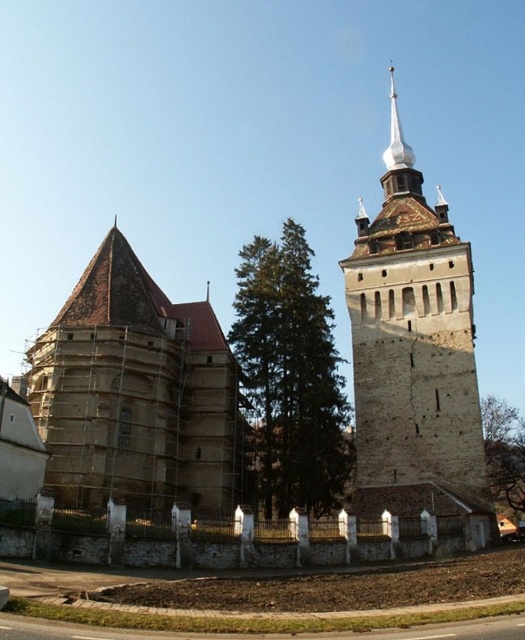
You are a visitor to the historic church and want to take a photo that includes both the green textured tree at center and the green leafy tree at lower right. Which tree should you position closer to the camera to ensure both are in the frame without cropping?

To include both the green textured tree at center and the green leafy tree at lower right in the photo without cropping, position the green textured tree at center closer to the camera since it is smaller than the green leafy tree at lower right. This way, the smaller tree will appear larger in the frame, balancing their sizes and ensuring both fit within the photo.

You are standing in front of the historic stone church and notice two trees. Which tree, the green textured tree at center or the green leafy tree at lower right, is positioned to the left of the other?

The green textured tree at center is positioned to the left of the green leafy tree at lower right.

You are standing in a park and see the brown wooden church at center and the green leafy tree at lower right. Which object is positioned to the left of the other?

The brown wooden church at center is positioned to the left of the green leafy tree at lower right.